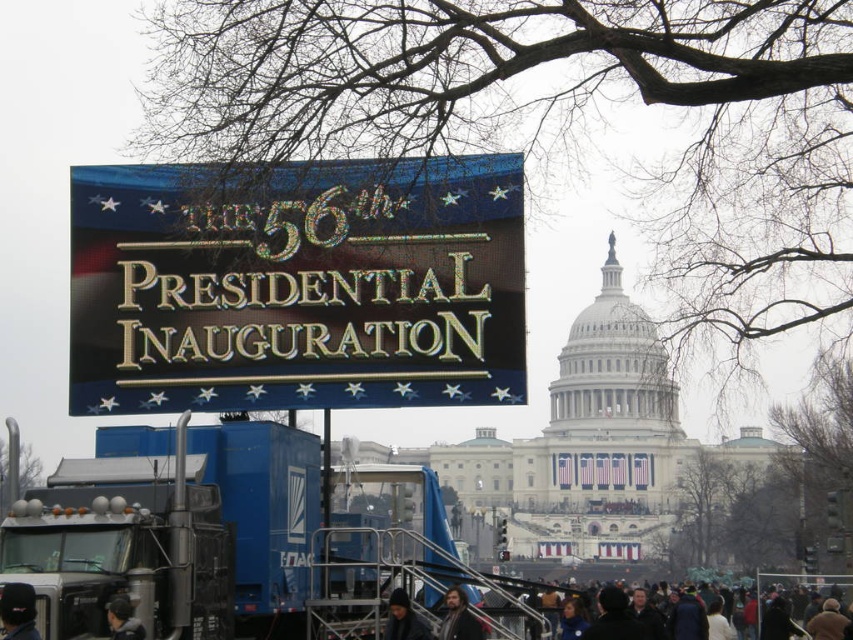
Who is higher up, shiny metallic sign at center or dark gray clothing at lower center?

Positioned higher is shiny metallic sign at center.

Which is below, shiny metallic sign at center or dark gray clothing at lower center?

dark gray clothing at lower center

Between point (415, 168) and point (749, 624), which one is positioned in front?

Point (415, 168) is more forward.

I want to click on shiny metallic sign at center, so click(x=297, y=285).

Describe the element at coordinates (404, 620) in the screenshot. Image resolution: width=853 pixels, height=640 pixels. I see `dark gray knit hat at lower center` at that location.

Between point (398, 588) and point (142, 632), which one is positioned in front?

Positioned in front is point (142, 632).

Between point (392, 616) and point (131, 636), which one is positioned behind?

Positioned behind is point (392, 616).

Image resolution: width=853 pixels, height=640 pixels. I want to click on dark gray knit hat at lower center, so click(x=404, y=620).

Is point (256, 611) less distant than point (404, 625)?

Yes.

Consider the image. Which of these two, blue metallic trailer truck at lower left or dark gray knit hat at lower center, stands taller?

Standing taller between the two is blue metallic trailer truck at lower left.

Image resolution: width=853 pixels, height=640 pixels. What do you see at coordinates (175, 532) in the screenshot?
I see `blue metallic trailer truck at lower left` at bounding box center [175, 532].

The height and width of the screenshot is (640, 853). I want to click on blue metallic trailer truck at lower left, so pos(175,532).